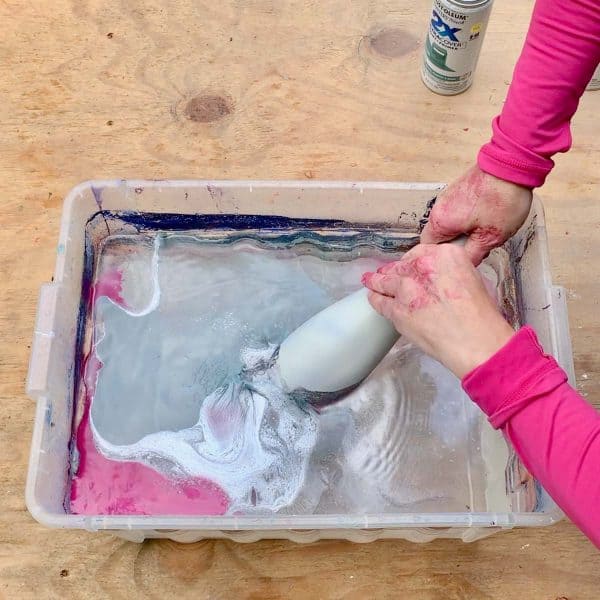
Identify the location of pink paint. (154, 489).